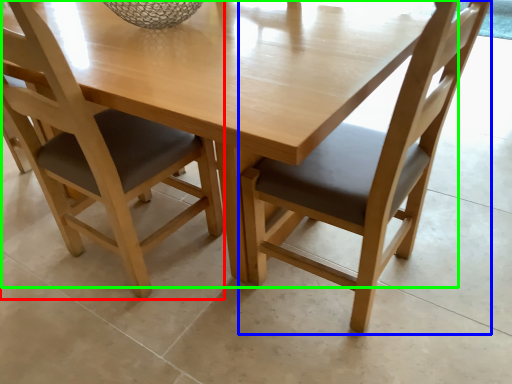
Question: Considering the real-world distances, which object is farthest from chair (highlighted by a red box)? chair (highlighted by a blue box) or round table (highlighted by a green box)?

Choices:
 (A) chair
 (B) round table

Answer: (A)